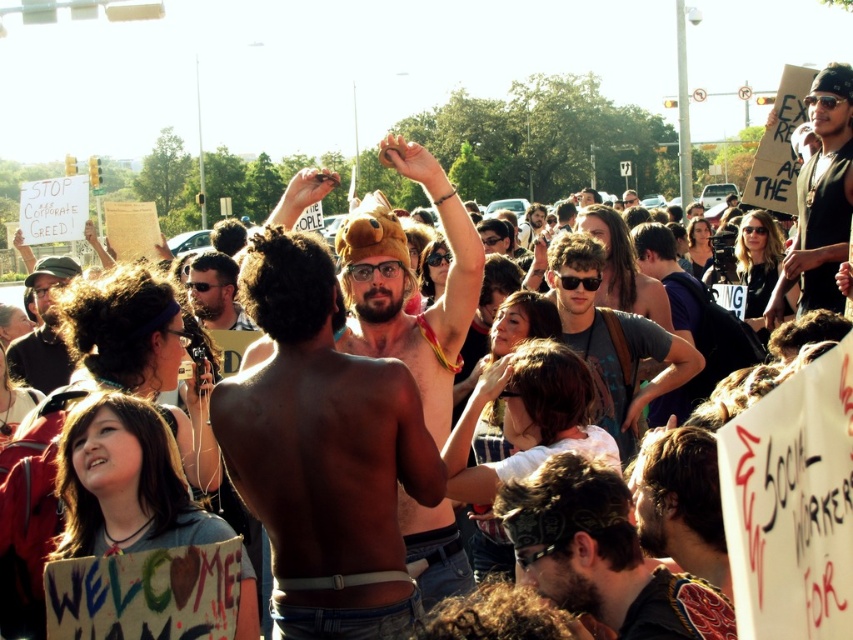
Is point (425, 385) behind point (582, 298)?

No.

Between shiny gold headband at center and dark brown hair at center, which one has less height?

Standing shorter between the two is dark brown hair at center.

Between point (410, 317) and point (674, 355), which one is positioned in front?

Point (410, 317)

Locate an element on the screen. The image size is (853, 640). shiny gold headband at center is located at coordinates (409, 284).

Is shiny metallic tank top at center to the right of dark brown leather jacket at lower right from the viewer's perspective?

In fact, shiny metallic tank top at center is to the left of dark brown leather jacket at lower right.

Is shiny metallic tank top at center shorter than dark brown leather jacket at lower right?

Incorrect, shiny metallic tank top at center's height does not fall short of dark brown leather jacket at lower right's.

The height and width of the screenshot is (640, 853). I want to click on shiny metallic tank top at center, so click(323, 452).

Is shiny metallic tank top at center to the right of matte black shirt at upper right from the viewer's perspective?

No, shiny metallic tank top at center is not to the right of matte black shirt at upper right.

Is shiny metallic tank top at center positioned in front of matte black shirt at upper right?

Yes, shiny metallic tank top at center is closer to the viewer.

Does point (281, 317) lie in front of point (813, 266)?

That is True.

Find the location of a particular element. This screenshot has width=853, height=640. shiny metallic tank top at center is located at coordinates (323, 452).